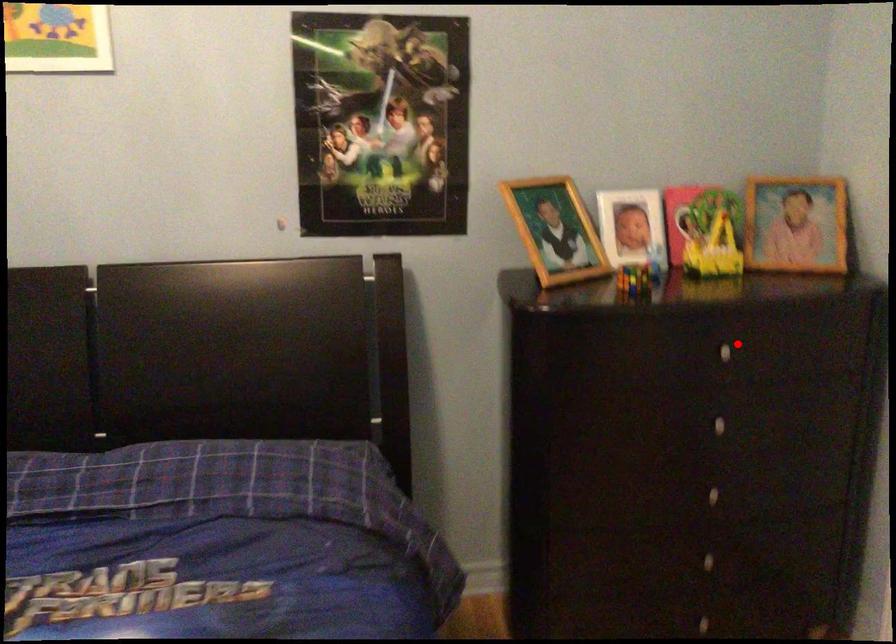
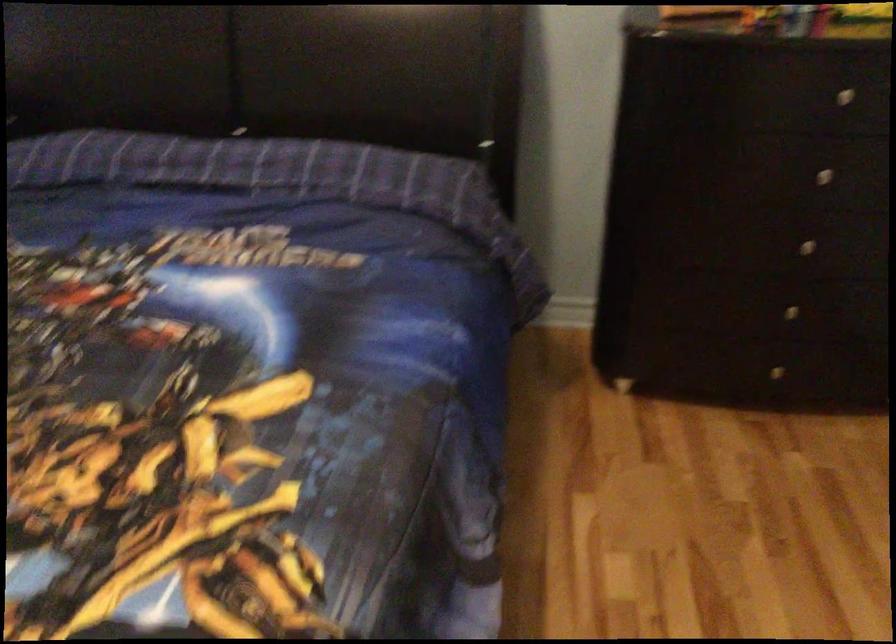
The point at the highlighted location is marked in the first image. Where is the corresponding point in the second image?

(858, 91)